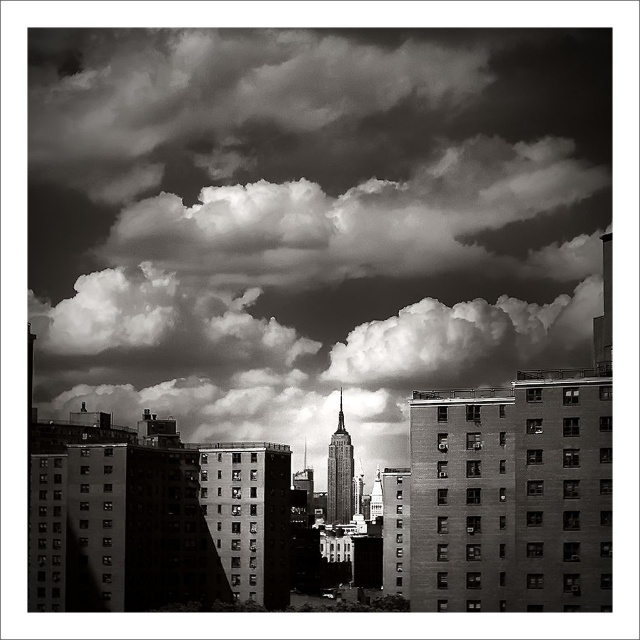
Consider the image. You are a drone operator planning to fly a drone between the cloudy sky at upper center and the smooth glass skyscraper at center. The drone has a maximum flight distance of 100 meters. Can the drone safely travel between these two points without exceeding its range?

The distance between the cloudy sky at upper center and the smooth glass skyscraper at center is 85.81 meters, which is within the drone operator drone maximum flight distance of 100 meters. Yes, the drone can safely travel between these two points without exceeding its range.

From the picture: You are an architect analyzing the urban layout. Given the presence of the cloudy sky at upper center and the smooth glass skyscraper at center, which one appears closer to you in the photograph?

The cloudy sky at upper center appears closer because it is further to the viewer than the smooth glass skyscraper at center.